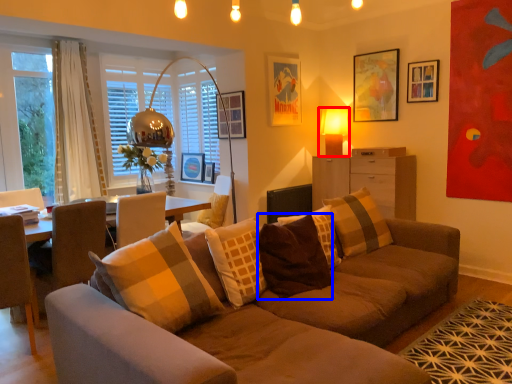
Question: Which of the following is the closest to the observer, table lamp (highlighted by a red box) or pillow (highlighted by a blue box)?

Choices:
 (A) table lamp
 (B) pillow

Answer: (B)